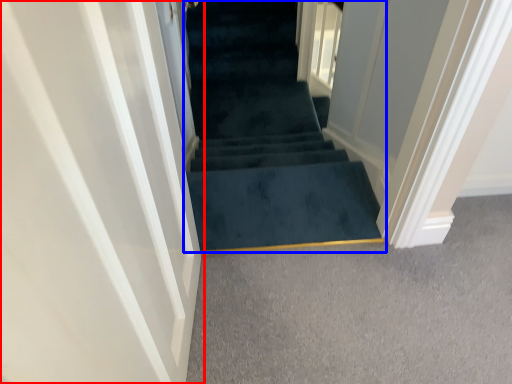
Question: Among these objects, which one is nearest to the camera, door (highlighted by a red box) or stairs (highlighted by a blue box)?

Choices:
 (A) door
 (B) stairs

Answer: (A)